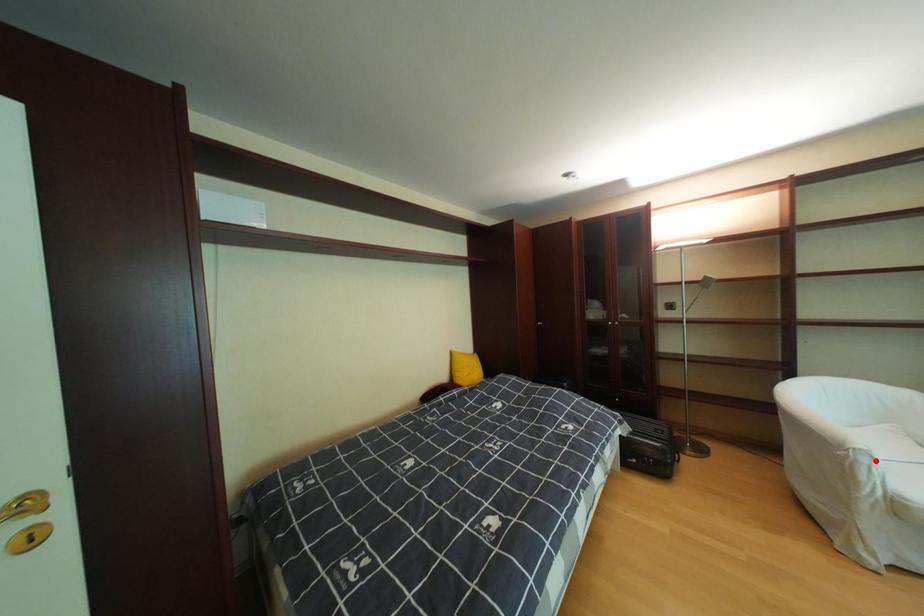
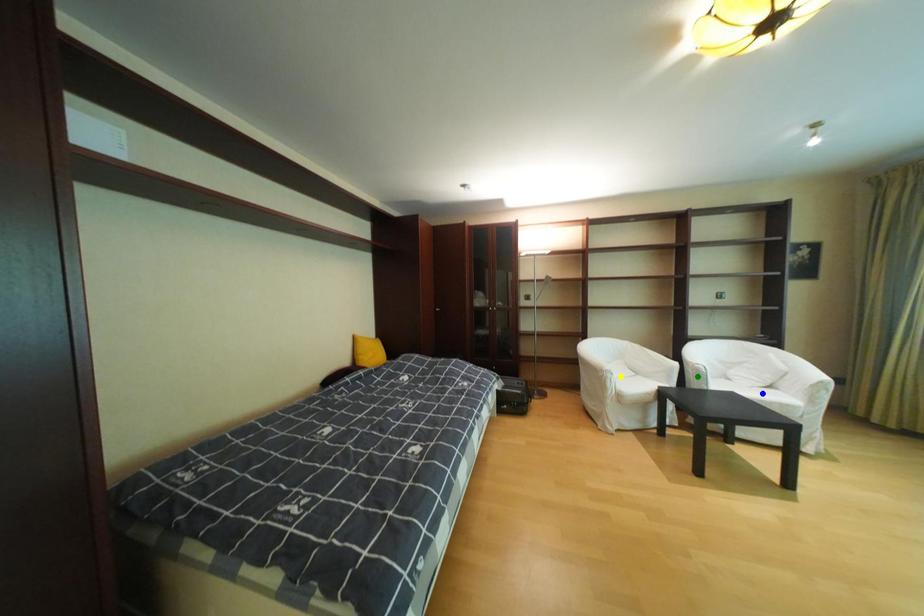
Question: I am providing you with two images of the same scene from different viewpoints. A red point is marked on the first image. You are given multiple points on the second image. Which point in image 2 is actually the same real-world point as the red point in image 1?

Choices:
 (A) yellow point
 (B) green point
 (C) blue point

Answer: (A)